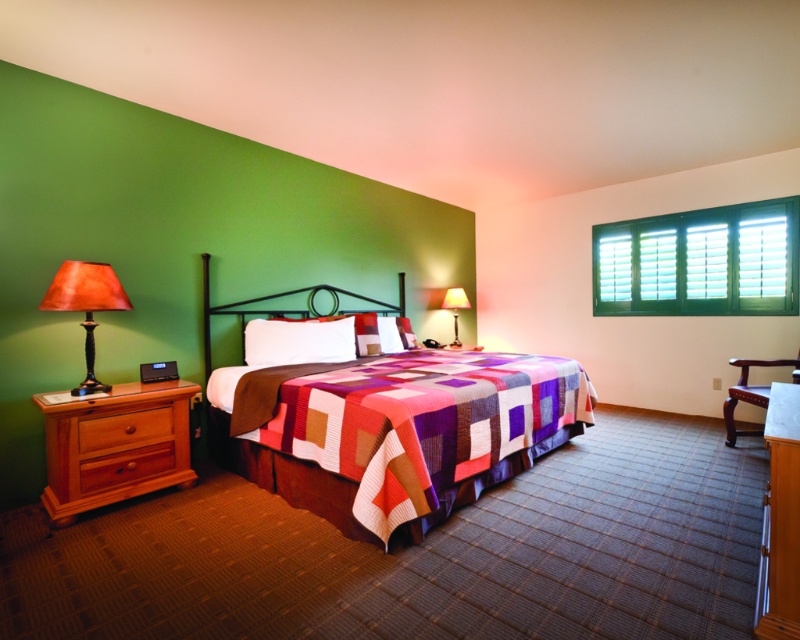
You are standing in the center of the hotel room and want to place a tall vase on the highest available dresser. Which dresser should you choose between the brown wood dresser at left and the white glossy dresser at lower right?

The white glossy dresser at lower right is higher than the brown wood dresser at left, so you should place the tall vase on the white glossy dresser at lower right.

You are standing in the hotel room and want to move from the bed to a specific point. Which of the two points, point (362, 472) or point (240, 304), is closer to you?

Point (362, 472) is closer to the viewer than point (240, 304).

You are standing in the hotel room and want to place a small decoration between the two points labeled point (98, 388) and point (462, 291). Since you want the decoration to be closer to the camera, which point should it be placed nearer to?

The decoration should be placed nearer to point (98, 388) because it is closer to the camera than point (462, 291).